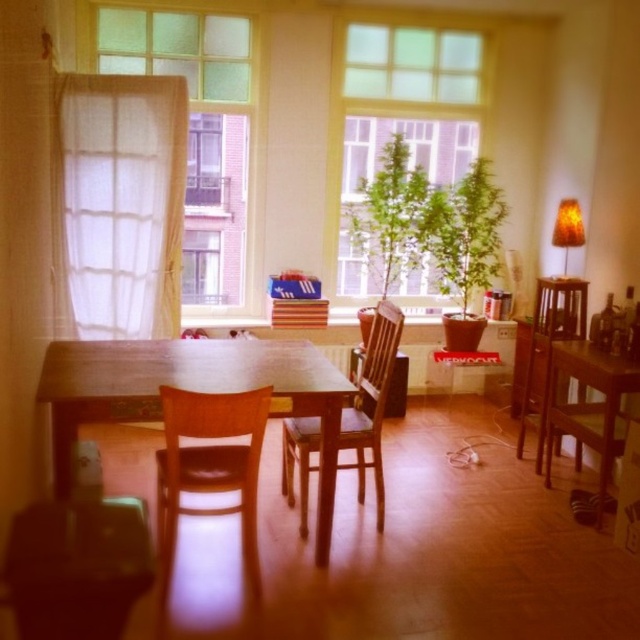
You are standing in the dining area and want to open the window to let in more light. The control point for the window is marked at point (122, 202). Is this control point located to the left or right of the white sheer curtain at left?

The white sheer curtain at left is located at point (122, 202), so the control point is exactly at the position of the white sheer curtain at left.

You are standing at the entrance of the dining area and want to move towards the wooden table at right. Based on the coordinates provided, in which direction should you move relative to your current position?

The wooden table at right is located at coordinates point (589, 406). Since the x and y coordinates are both high, you should move towards the upper right direction from your current position to reach it.